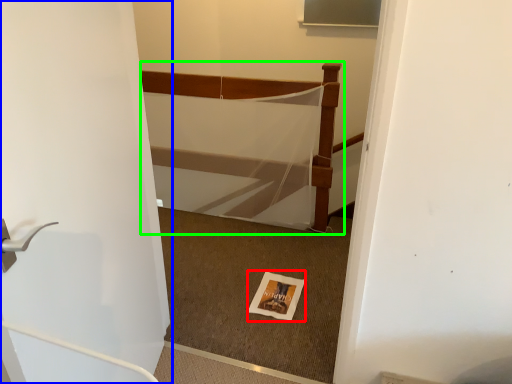
Question: Which is farther away from postcard (highlighted by a red box)? door (highlighted by a blue box) or bed (highlighted by a green box)?

Choices:
 (A) door
 (B) bed

Answer: (A)